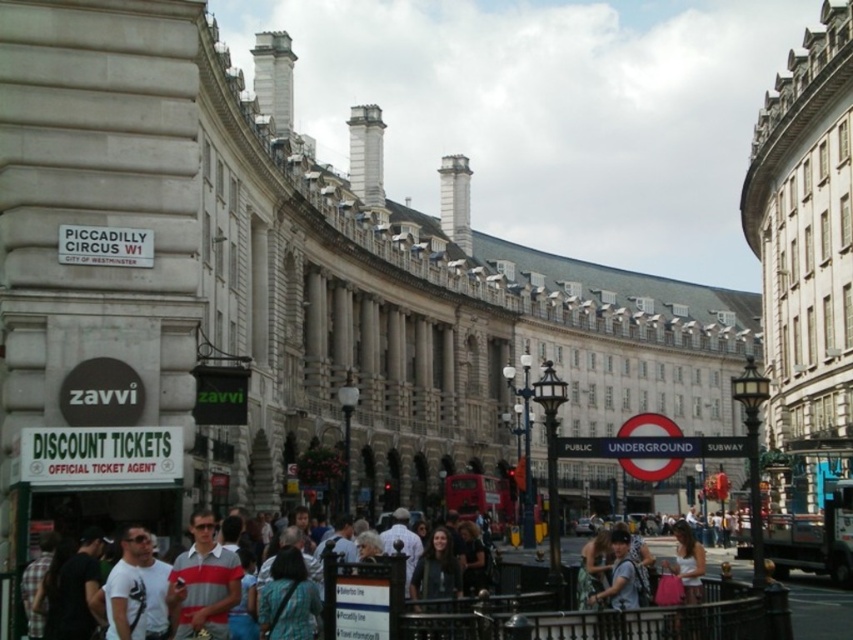
Question: Does light blue shirt at center appear over striped polo shirt at center?

Choices:
 (A) yes
 (B) no

Answer: (B)

Question: Does light blue shirt at center have a lesser width compared to striped polo shirt at center?

Choices:
 (A) no
 (B) yes

Answer: (A)

Question: Can you confirm if light blue shirt at center is wider than striped polo shirt at center?

Choices:
 (A) no
 (B) yes

Answer: (B)

Question: Among these objects, which one is nearest to the camera?

Choices:
 (A) light blue shirt at center
 (B) striped polo shirt at center

Answer: (A)

Question: Which point is farther to the camera?

Choices:
 (A) (235, 595)
 (B) (398, 621)

Answer: (A)